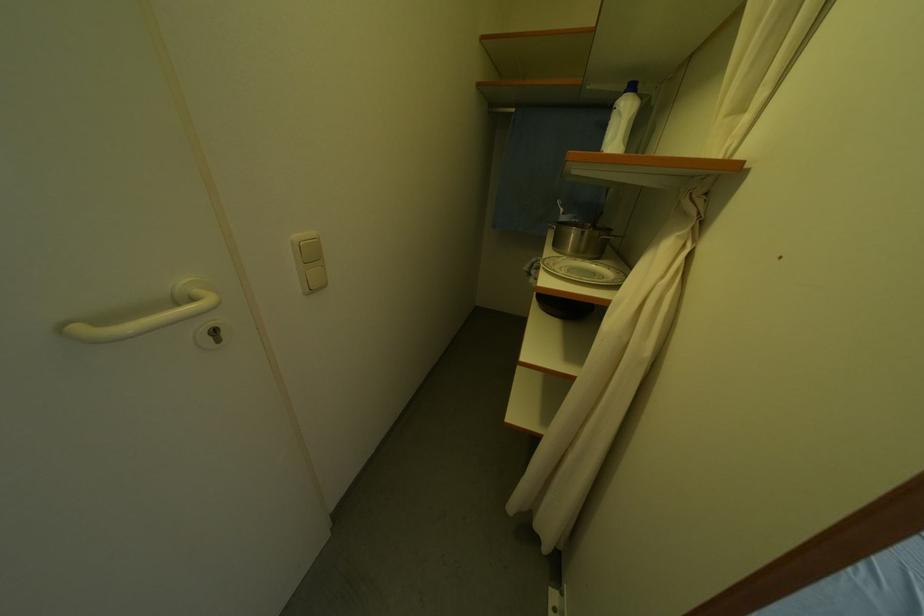
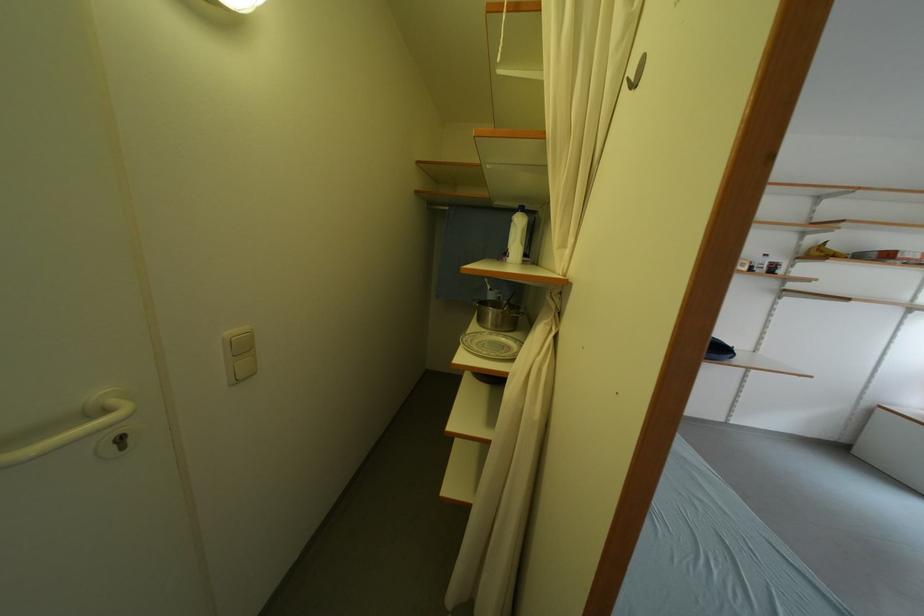
Question: How did the camera likely rotate?

Choices:
 (A) Left
 (B) Right
 (C) Up
 (D) Down

Answer: (C)